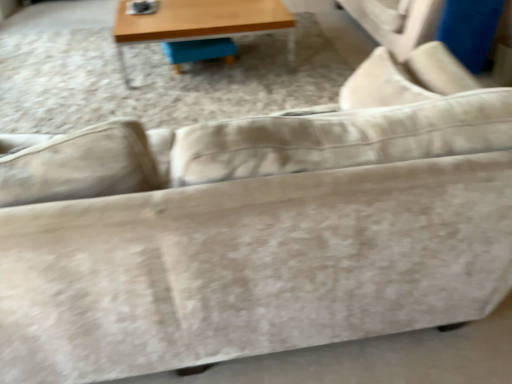
Question: Is blue fabric swivel chair at center at the back of wooden table at upper center?

Choices:
 (A) no
 (B) yes

Answer: (B)

Question: Does wooden table at upper center have a greater width compared to blue fabric swivel chair at center?

Choices:
 (A) yes
 (B) no

Answer: (A)

Question: Does wooden table at upper center have a greater height compared to blue fabric swivel chair at center?

Choices:
 (A) yes
 (B) no

Answer: (A)

Question: Could blue fabric swivel chair at center be considered to be inside wooden table at upper center?

Choices:
 (A) no
 (B) yes

Answer: (B)

Question: Is the position of wooden table at upper center more distant than that of blue fabric swivel chair at center?

Choices:
 (A) no
 (B) yes

Answer: (A)

Question: Is wooden table at upper center bigger than blue fabric swivel chair at center?

Choices:
 (A) no
 (B) yes

Answer: (B)

Question: Does blue fabric swivel chair at center have a lesser height compared to wooden table at upper center?

Choices:
 (A) yes
 (B) no

Answer: (A)

Question: Can you confirm if blue fabric swivel chair at center is positioned to the left of wooden table at upper center?

Choices:
 (A) yes
 (B) no

Answer: (A)

Question: From a real-world perspective, is blue fabric swivel chair at center on top of wooden table at upper center?

Choices:
 (A) no
 (B) yes

Answer: (A)

Question: Is blue fabric swivel chair at center taller than wooden table at upper center?

Choices:
 (A) yes
 (B) no

Answer: (B)

Question: Is blue fabric swivel chair at center in contact with wooden table at upper center?

Choices:
 (A) no
 (B) yes

Answer: (A)

Question: Considering the relative sizes of blue fabric swivel chair at center and wooden table at upper center in the image provided, is blue fabric swivel chair at center bigger than wooden table at upper center?

Choices:
 (A) yes
 (B) no

Answer: (B)

Question: Is point (207, 49) positioned closer to the camera than point (122, 74)?

Choices:
 (A) closer
 (B) farther

Answer: (B)